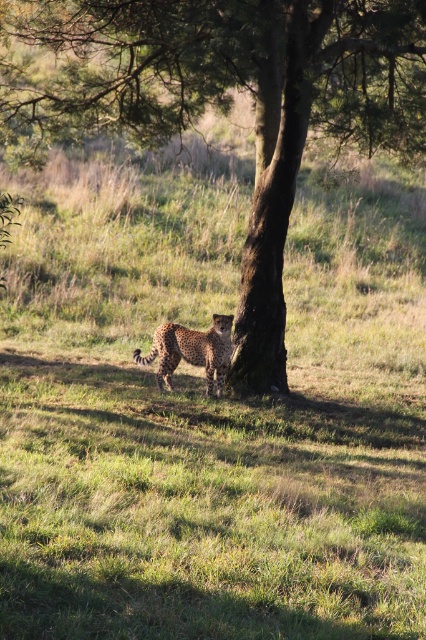
Question: Can you confirm if brown rough tree at center is positioned below spotted fur cheetah at center?

Choices:
 (A) yes
 (B) no

Answer: (B)

Question: Is brown rough tree at center in front of spotted fur cheetah at center?

Choices:
 (A) yes
 (B) no

Answer: (A)

Question: Is brown rough tree at center positioned before spotted fur cheetah at center?

Choices:
 (A) no
 (B) yes

Answer: (B)